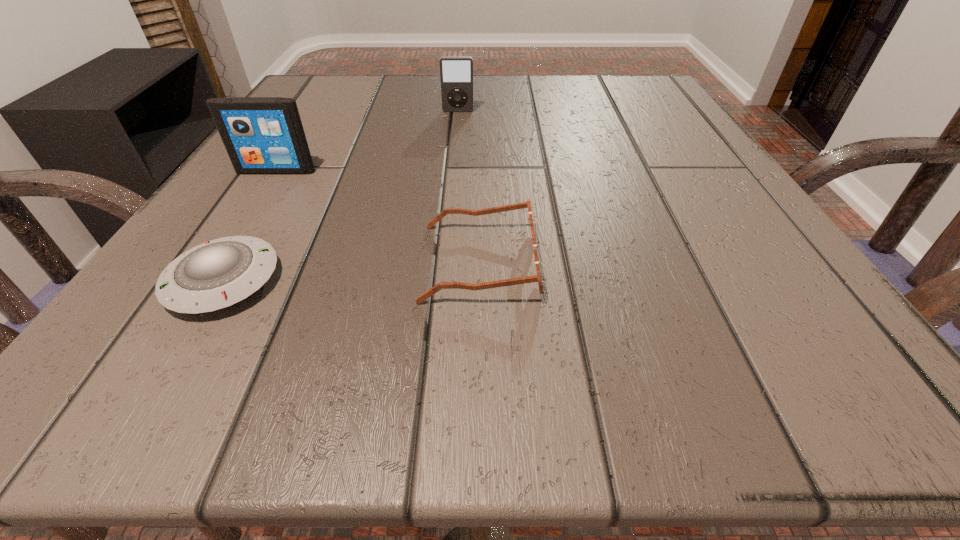
The width and height of the screenshot is (960, 540). Find the location of `free space that is in between the third tallest object and the saucer`. free space that is in between the third tallest object and the saucer is located at coordinates (351, 271).

The width and height of the screenshot is (960, 540). Find the location of `free space that is in between the third tallest object and the shorter iPod`. free space that is in between the third tallest object and the shorter iPod is located at coordinates (468, 186).

The width and height of the screenshot is (960, 540). In order to click on unoccupied position between the second shortest object and the left iPod in this screenshot , I will do `click(378, 216)`.

Locate an element on the screen. The image size is (960, 540). vacant point located between the spectacles and the saucer is located at coordinates (351, 271).

Locate an element on the screen. This screenshot has width=960, height=540. vacant space that's between the second shortest object and the shortest object is located at coordinates (351, 271).

In order to click on vacant area between the spectacles and the nearer iPod in this screenshot , I will do `click(378, 216)`.

At what (x,y) coordinates should I click in order to perform the action: click on free space between the second shortest object and the left iPod. Please return your answer as a coordinate pair (x, y). Image resolution: width=960 pixels, height=540 pixels. Looking at the image, I should click on (378, 216).

Identify the location of vacant space that is in between the spectacles and the nearer iPod. The image size is (960, 540). (378, 216).

Locate an element on the screen. This screenshot has width=960, height=540. empty location between the farthest object and the saucer is located at coordinates (341, 196).

The height and width of the screenshot is (540, 960). Identify the location of blank region between the shortest object and the second shortest object. (351, 271).